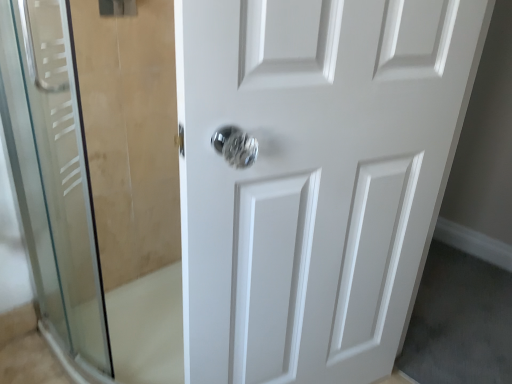
What do you see at coordinates (313, 177) in the screenshot? I see `white glossy door at center` at bounding box center [313, 177].

At what (x,y) coordinates should I click in order to perform the action: click on white glossy door at center. Please return your answer as a coordinate pair (x, y). Looking at the image, I should click on (313, 177).

Locate an element on the screen. white glossy door at center is located at coordinates (313, 177).